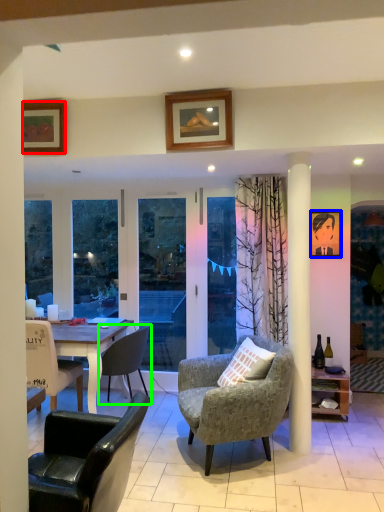
Question: Which object is positioned farthest from picture frame (highlighted by a red box)? Select from picture frame (highlighted by a blue box) and chair (highlighted by a green box).

Choices:
 (A) picture frame
 (B) chair

Answer: (A)